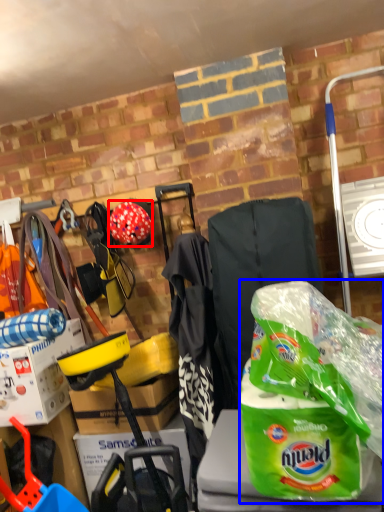
Question: Which point is closer to the camera, helmet (highlighted by a red box) or plastic bag (highlighted by a blue box)?

Choices:
 (A) helmet
 (B) plastic bag

Answer: (B)